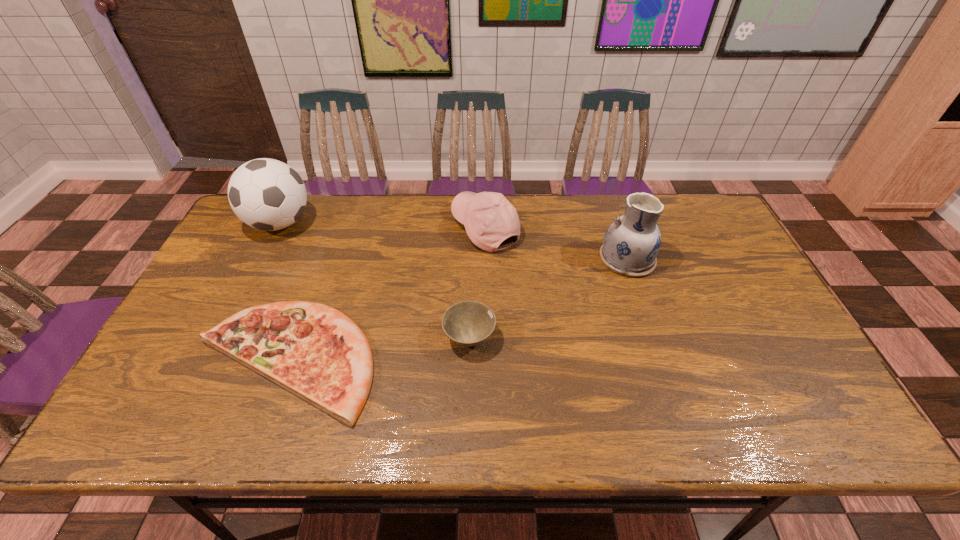
You are a GUI agent. You are given a task and a screenshot of the screen. Output one action in this format:
    pyautogui.click(x=<x>, y=<y>)
    Task: Click on the soccer ball
    
    Given the screenshot: What is the action you would take?
    pyautogui.click(x=266, y=194)

Image resolution: width=960 pixels, height=540 pixels. Find the location of `the rightmost object`. the rightmost object is located at coordinates (631, 244).

Find the location of `baseball cap`. baseball cap is located at coordinates (489, 218).

Locate an element on the screen. The width and height of the screenshot is (960, 540). bowl is located at coordinates [x=468, y=323].

The width and height of the screenshot is (960, 540). I want to click on pizza, so click(316, 352).

Identify the location of vacant space located 0.180m on the front of the soccer ball. The height and width of the screenshot is (540, 960). (248, 288).

At what (x,y) coordinates should I click in order to perform the action: click on vacant space positioned 0.210m on the right of the rightmost object. Please return your answer as a coordinate pair (x, y). This screenshot has height=540, width=960. Looking at the image, I should click on (725, 259).

Identify the location of vacant area located 0.150m on the front-facing side of the baseball cap. (405, 228).

Where is `free space located 0.200m on the front-facing side of the baseball cap`? free space located 0.200m on the front-facing side of the baseball cap is located at coordinates (390, 228).

Where is `vacant region located on the front-facing side of the baseball cap`? Image resolution: width=960 pixels, height=540 pixels. vacant region located on the front-facing side of the baseball cap is located at coordinates (383, 228).